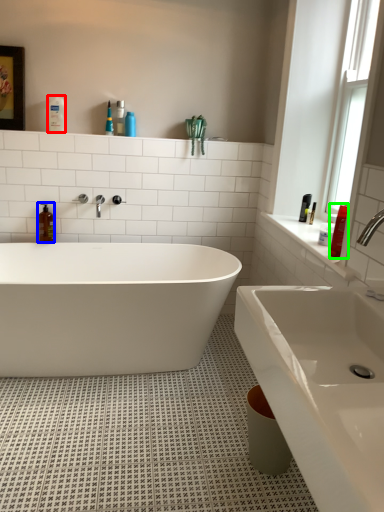
Question: Considering the real-world distances, which object is farthest from toiletry (highlighted by a red box)? soap dispenser (highlighted by a blue box) or toiletry (highlighted by a green box)?

Choices:
 (A) soap dispenser
 (B) toiletry

Answer: (B)